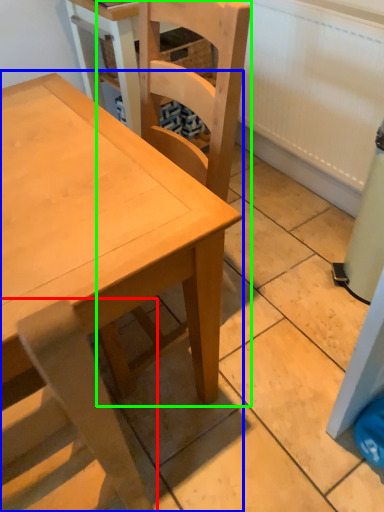
Question: Which is farther away from chair (highlighted by a red box)? table (highlighted by a blue box) or chair (highlighted by a green box)?

Choices:
 (A) table
 (B) chair

Answer: (B)